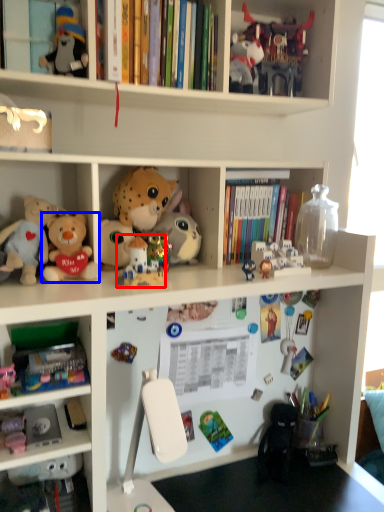
Question: Which object is further to the camera taking this photo, toy (highlighted by a red box) or toy (highlighted by a blue box)?

Choices:
 (A) toy
 (B) toy

Answer: (A)